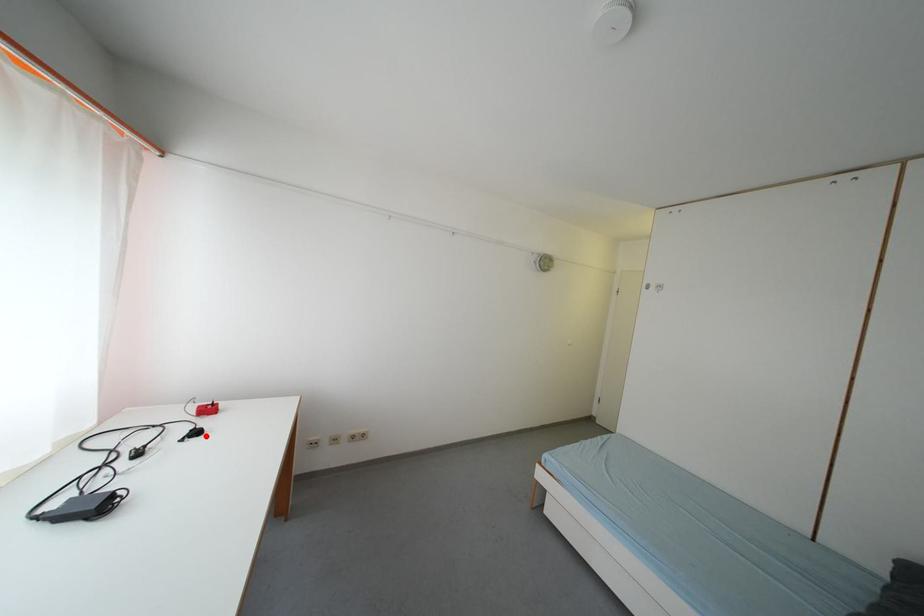
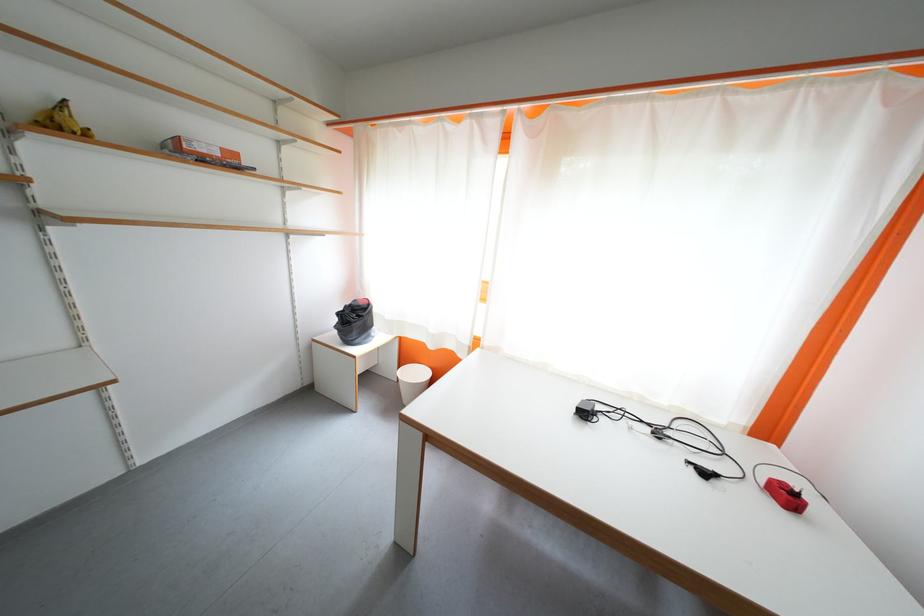
In the second image, find the point that corresponds to the highlighted location in the first image.

(713, 477)